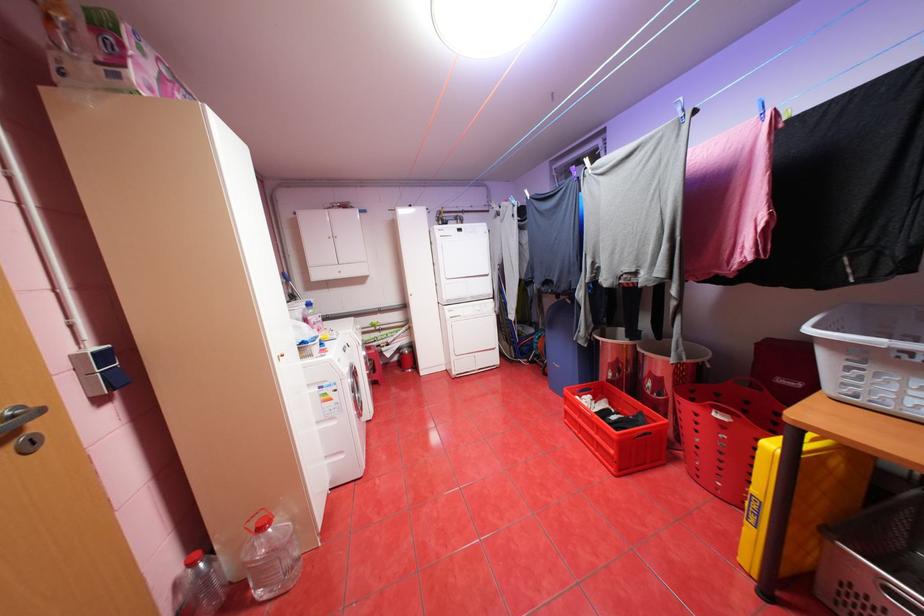
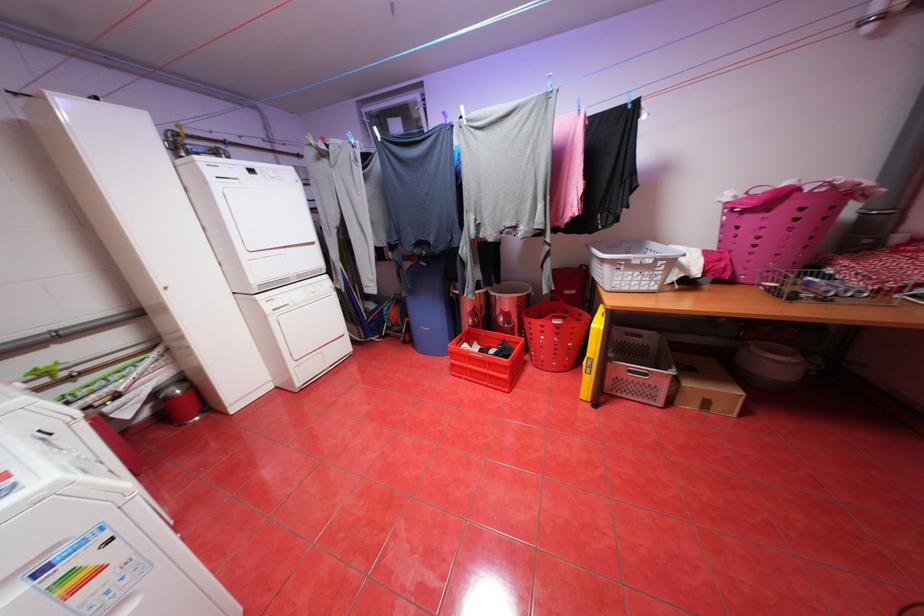
In the second image, find the point that corresponds to (x=618, y=403) in the first image.

(488, 344)